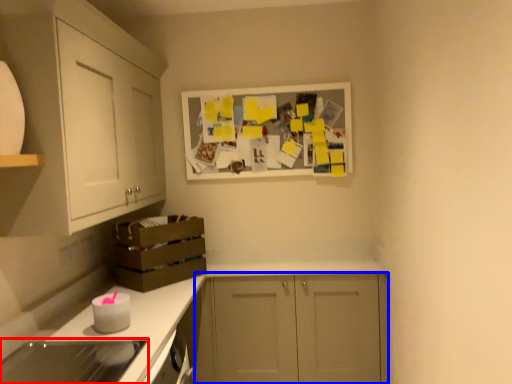
Question: Which object appears closest to the camera in this image, appliance (highlighted by a red box) or cabinetry (highlighted by a blue box)?

Choices:
 (A) appliance
 (B) cabinetry

Answer: (A)